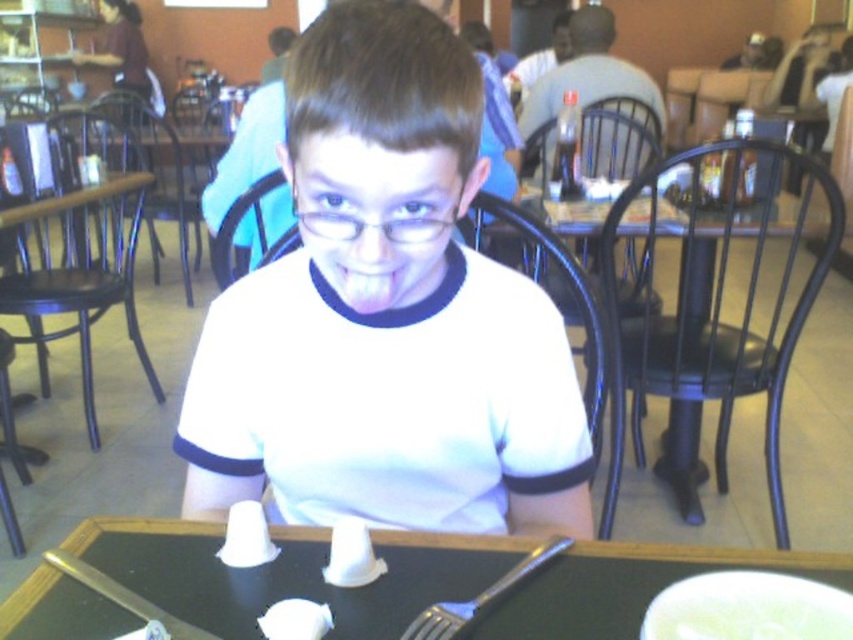
Question: In this image, where is clear plastic glasses at center located relative to shiny metal fork at lower center?

Choices:
 (A) above
 (B) below

Answer: (A)

Question: Which point is farther to the camera?

Choices:
 (A) (764, 412)
 (B) (45, 560)

Answer: (A)

Question: Which point is closer to the camera?

Choices:
 (A) shiny metal fork at lower center
 (B) white matte shirt at center
 (C) clear plastic glasses at center
 (D) black plastic table at lower center

Answer: (B)

Question: Is black wood table at center further to camera compared to shiny metal fork at lower center?

Choices:
 (A) yes
 (B) no

Answer: (A)

Question: Which of the following is the closest to the observer?

Choices:
 (A) shiny metallic fork at lower center
 (B) clear plastic glasses at center
 (C) shiny metal fork at lower center
 (D) white matte shirt at center

Answer: (D)

Question: Can you confirm if black plastic table at lower center is positioned to the left of black wood table at center?

Choices:
 (A) yes
 (B) no

Answer: (A)